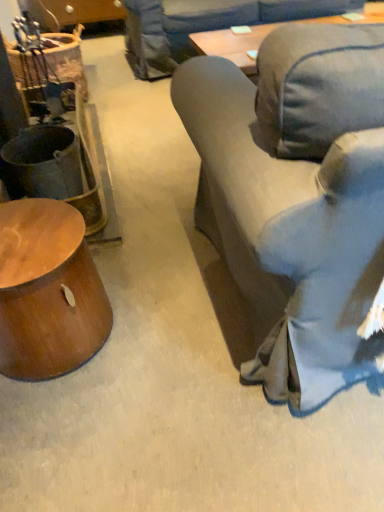
This screenshot has height=512, width=384. What are the coordinates of `free spot to the left of denim fabric couch at right` in the screenshot? It's located at (141, 312).